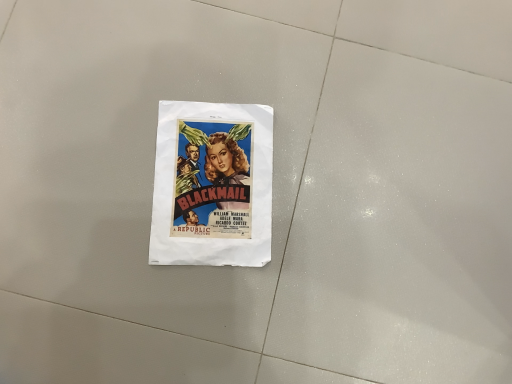
Where is `free space above matte paper poster at center (from a real-world perspective)`? free space above matte paper poster at center (from a real-world perspective) is located at coordinates (207, 174).